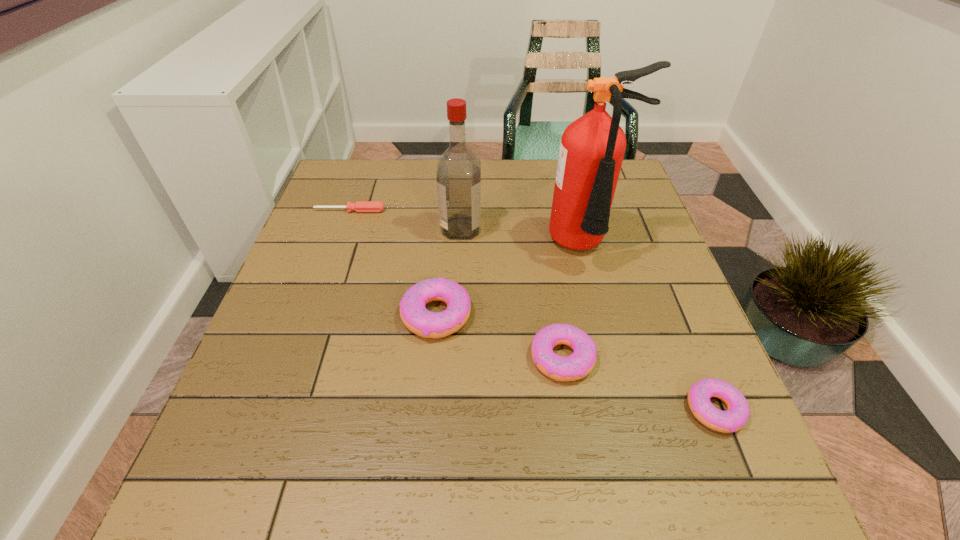
This screenshot has height=540, width=960. I want to click on object at the near right corner, so click(x=737, y=414).

In the image, there is a desktop. In order to click on vacant space at the far edge in this screenshot , I will do `click(404, 185)`.

Find the location of `free space at the left edge of the desktop`. free space at the left edge of the desktop is located at coordinates (330, 342).

This screenshot has height=540, width=960. I want to click on free space at the right edge of the desktop, so click(622, 257).

Where is `vacant position at the near left corner of the desktop`? vacant position at the near left corner of the desktop is located at coordinates (242, 416).

The image size is (960, 540). I want to click on free region at the far right corner, so click(625, 176).

Find the location of a particular element. This screenshot has height=540, width=960. unoccupied position between the fifth tallest object and the screwdriver is located at coordinates (532, 310).

Identify the location of empty space between the second doughnut from left to right and the rightmost object. The width and height of the screenshot is (960, 540). (638, 384).

Find the location of a particular element. This screenshot has height=540, width=960. empty space between the shortest doughnut and the shortest object is located at coordinates (532, 310).

The width and height of the screenshot is (960, 540). Find the location of `free spot between the second tallest doughnut and the liquor`. free spot between the second tallest doughnut and the liquor is located at coordinates (512, 293).